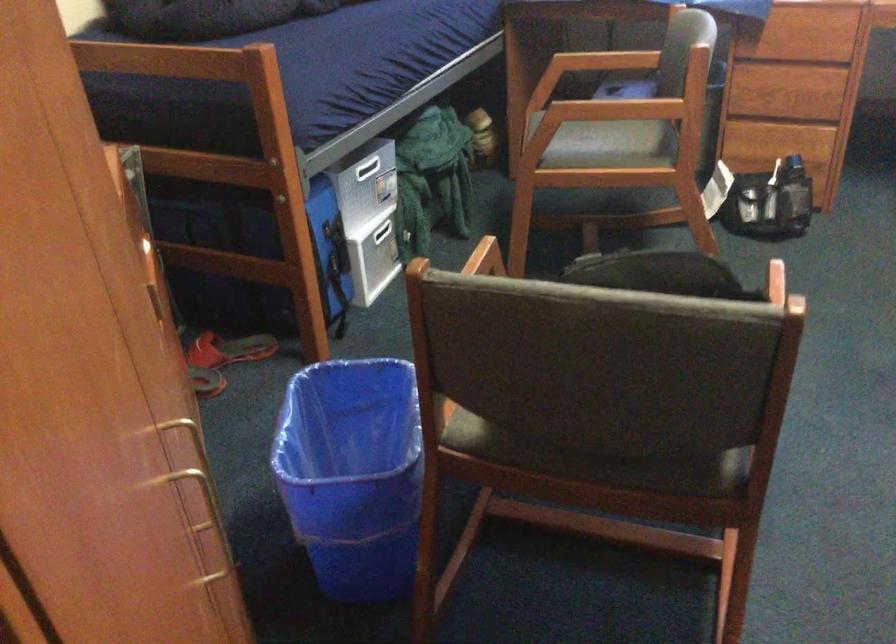
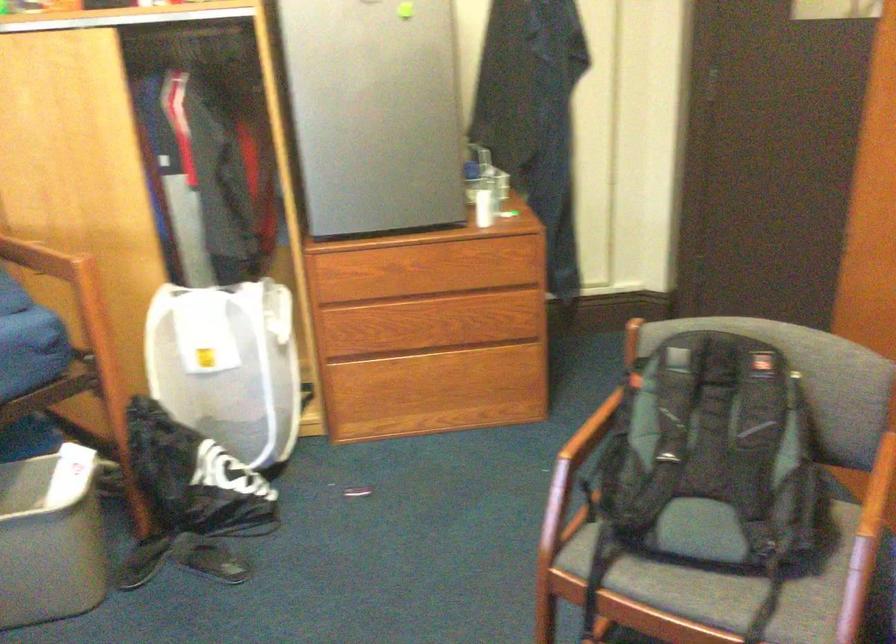
In the second image, find the point that corresponds to point (599, 325) in the first image.

(717, 456)